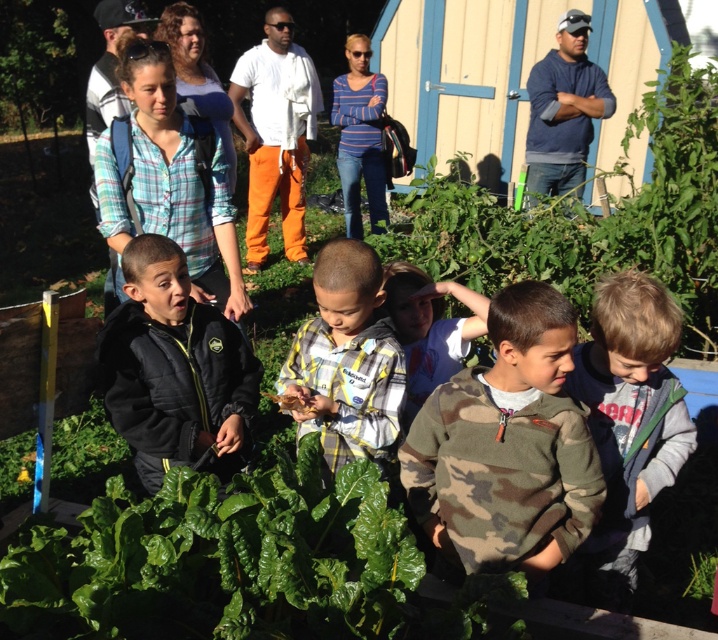
What is the object located at the coordinates point [508,445]?

The object located at point [508,445] is the camouflage sweater at center.

You are standing at the center of the community garden and see the camouflage sweater at center. Can you tell me what is located at the point with coordinates (x=508, y=445)?

The point with coordinates (x=508, y=445) indicates the camouflage sweater at center.

You are a photographer trying to capture a photo of both the camouflage sweater at center and the striped cotton shirt at center. Which one should you focus on first to ensure both are in clear focus?

You should focus on the camouflage sweater at center first since it is closer to the viewer than the striped cotton shirt at center, allowing both to be in focus when using proper depth of field.